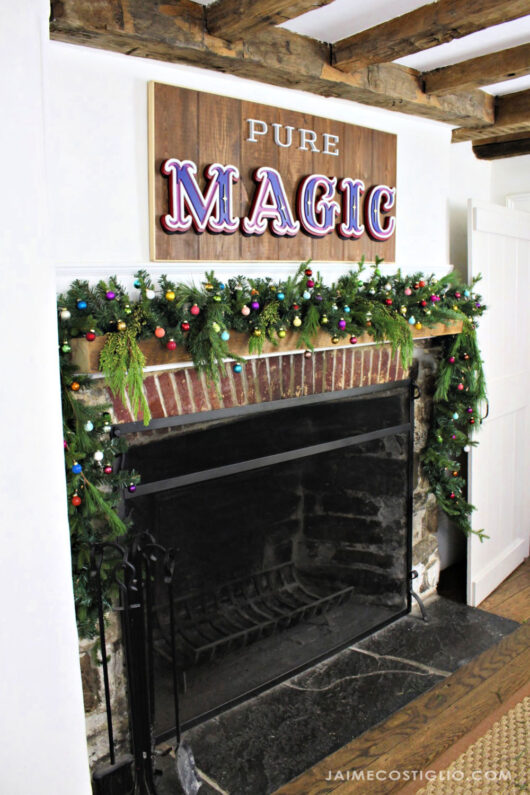
In order to click on wooden ceiling beam in this screenshot , I will do `click(152, 39)`, `click(284, 57)`, `click(407, 91)`, `click(503, 68)`, `click(427, 29)`, `click(264, 17)`, `click(511, 113)`.